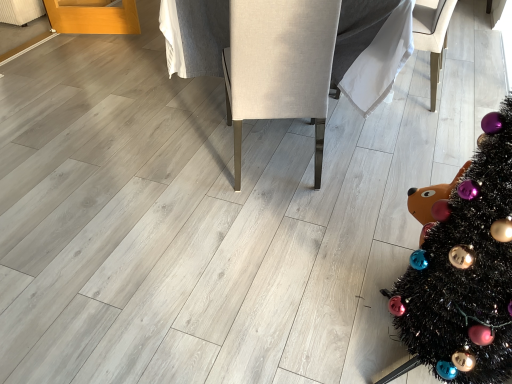
Question: From the image's perspective, is beige fabric armchair at center, the 2th armchair viewed from the right, located above or below white fabric armchair at center, the second armchair in the left-to-right sequence?

Choices:
 (A) above
 (B) below

Answer: (B)

Question: From a real-world perspective, is beige fabric armchair at center, which is the first armchair from left to right, physically located above or below white fabric armchair at center, placed as the 1th armchair when sorted from right to left?

Choices:
 (A) above
 (B) below

Answer: (A)

Question: Which object is positioned closest to the black tinsel christmas tree at lower right?

Choices:
 (A) white fabric armchair at center, placed as the 1th armchair when sorted from right to left
 (B) beige fabric armchair at center, which is the first armchair from left to right

Answer: (B)

Question: Which of these objects is positioned closest to the white fabric armchair at center, the second armchair in the left-to-right sequence?

Choices:
 (A) beige fabric armchair at center, which is the first armchair from left to right
 (B) black tinsel christmas tree at lower right

Answer: (A)